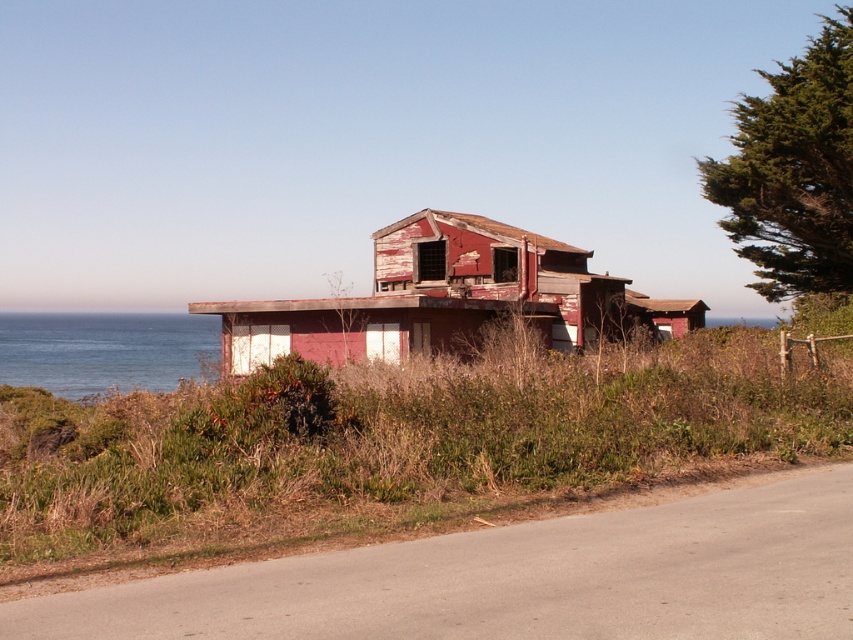
In the scene shown: You are a hiker who has come across this abandoned coastal area. You see a rusty metal shack at center and a peeling paint wooden hut at center. Which structure is positioned more to the left side of your view?

The rusty metal shack at center is positioned to the left of the peeling paint wooden hut at center, so the rusty metal shack at center is more to the left side of your view.